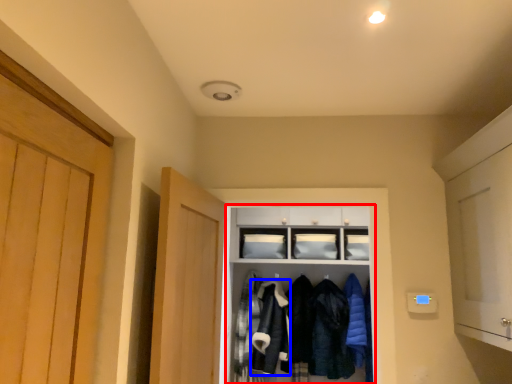
Question: Which point is closer to the camera, cabinetry (highlighted by a red box) or clothing (highlighted by a blue box)?

Choices:
 (A) cabinetry
 (B) clothing

Answer: (A)